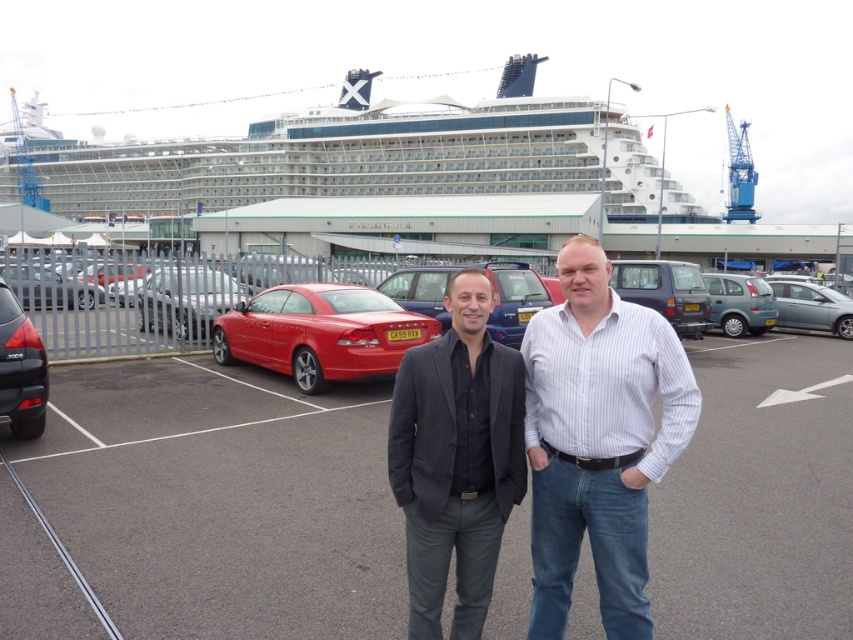
Who is more forward, (596, 557) or (408, 502)?

Point (408, 502) is in front.

You are a GUI agent. You are given a task and a screenshot of the screen. Output one action in this format:
    pyautogui.click(x=<x>, y=<y>)
    Task: Click on the white striped shirt at center
    
    Given the screenshot: What is the action you would take?
    pyautogui.click(x=598, y=440)

Does glossy red car at center lie behind matte black car at left?

Yes, it is.

Does glossy red car at center appear over matte black car at left?

Yes.

Is point (328, 330) positioned after point (1, 317)?

Yes, point (328, 330) is farther from viewer.

At what (x,y) coordinates should I click in order to perform the action: click on glossy red car at center. Please return your answer as a coordinate pair (x, y). This screenshot has height=640, width=853. Looking at the image, I should click on (320, 332).

Who is positioned more to the left, white glossy cruise ship at upper center or silver metallic hatchback at center right?

white glossy cruise ship at upper center

Can you confirm if white glossy cruise ship at upper center is positioned to the right of silver metallic hatchback at center right?

No, white glossy cruise ship at upper center is not to the right of silver metallic hatchback at center right.

What do you see at coordinates (358, 157) in the screenshot?
I see `white glossy cruise ship at upper center` at bounding box center [358, 157].

You are a GUI agent. You are given a task and a screenshot of the screen. Output one action in this format:
    pyautogui.click(x=<x>, y=<y>)
    Task: Click on the white glossy cruise ship at upper center
    The image size is (853, 640).
    Given the screenshot: What is the action you would take?
    pyautogui.click(x=358, y=157)